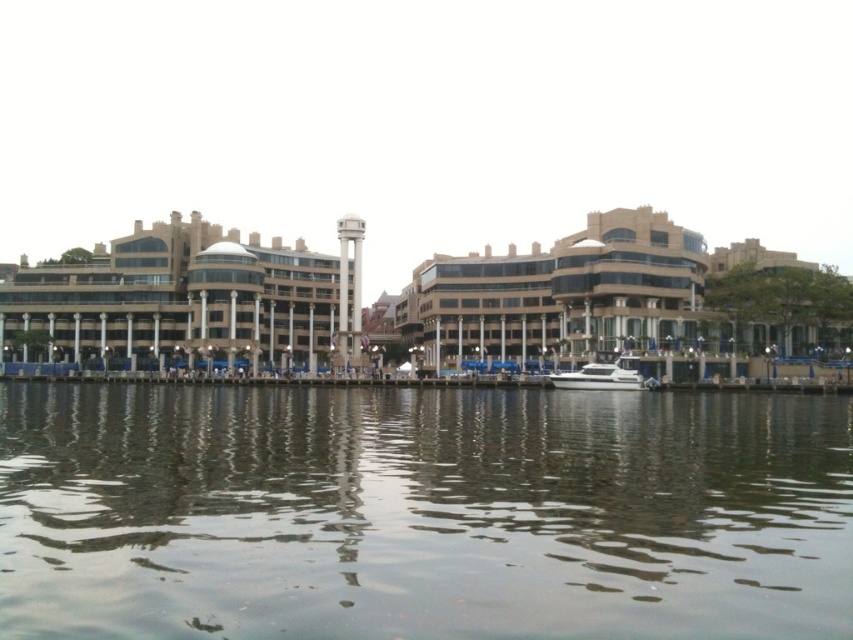
You are standing on the dock and looking at the greenish reflective water at center and the white glossy boat at center. Which one appears larger in size?

The greenish reflective water at center is bigger than the white glossy boat at center, so the greenish reflective water at center appears larger in size.

You are standing on the dock and looking at the greenish reflective water at center and the white glossy boat at center. Which object is taller from your viewpoint?

The greenish reflective water at center is taller than the white glossy boat at center according to the description.